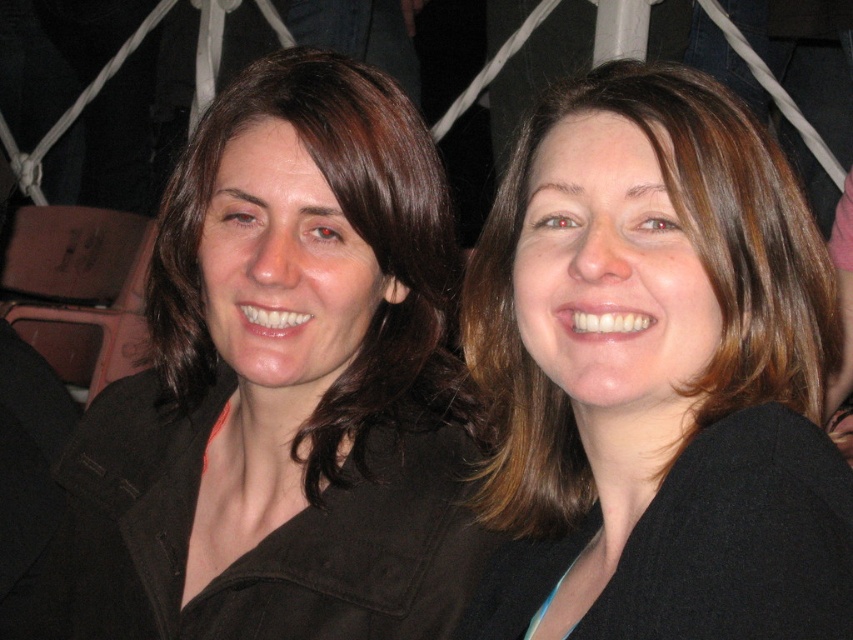
You are a photographer adjusting your camera settings to capture a clear image of the matte black jacket at center. Given that the jacket is 37.85 inches from the viewer, what is the minimum focusing distance your camera lens should have to ensure sharpness?

The matte black jacket at center is 37.85 inches from the viewer, so the camera lens must have a minimum focusing distance of at least 37.85 inches to capture it clearly.